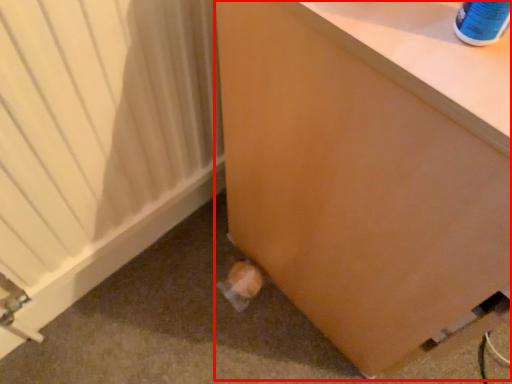
Question: Considering the relative positions of furniture (annotated by the red box) and heater in the image provided, where is furniture (annotated by the red box) located with respect to the staircase?

Choices:
 (A) right
 (B) left

Answer: (A)